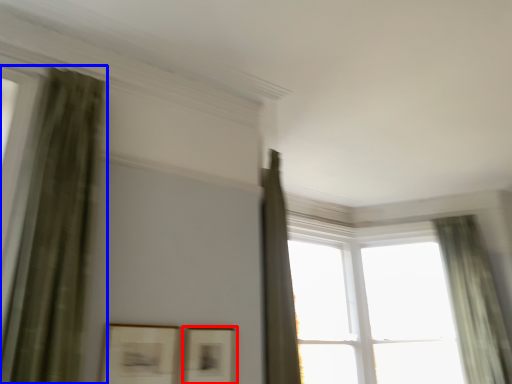
Question: Which point is further to the camera, picture frame (highlighted by a red box) or curtain (highlighted by a blue box)?

Choices:
 (A) picture frame
 (B) curtain

Answer: (A)